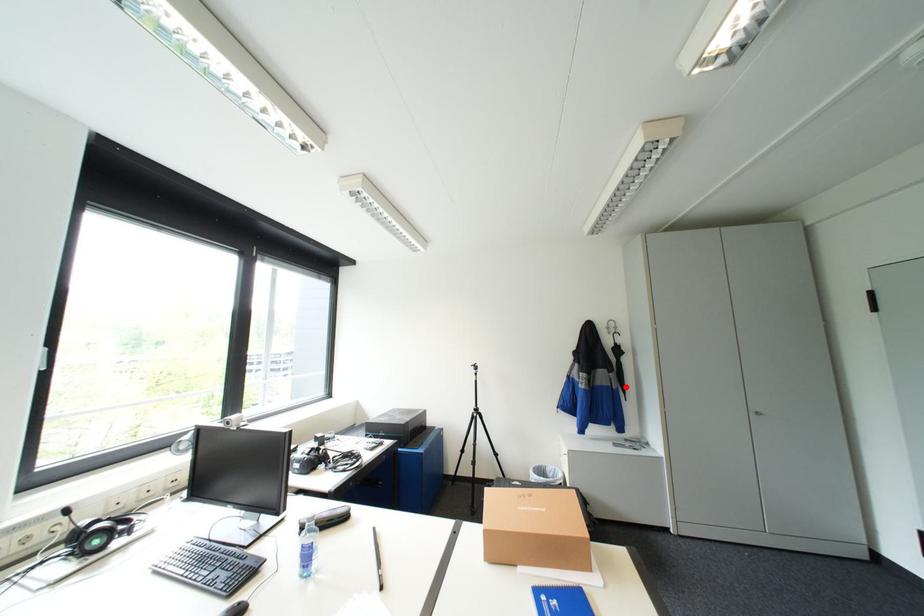
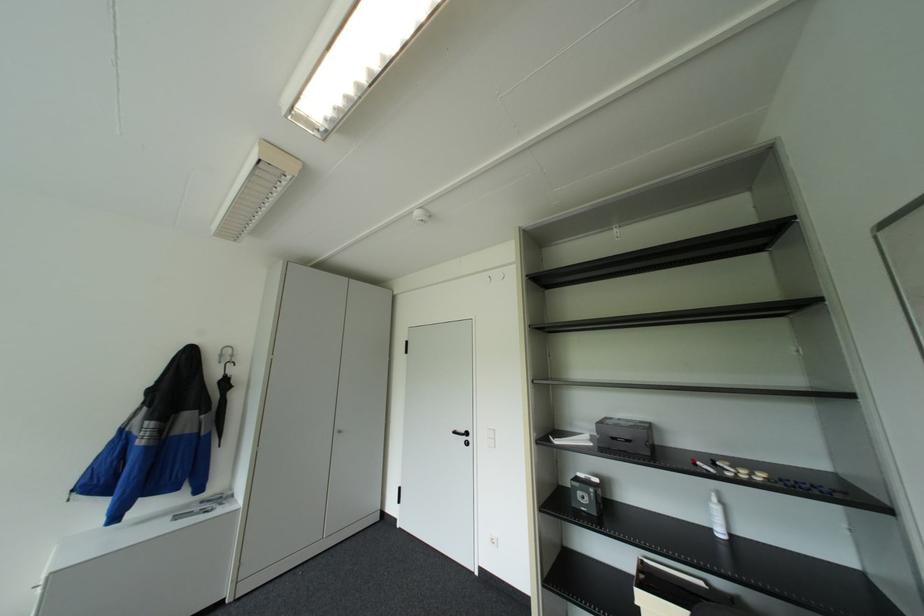
Question: I am providing you with two images of the same scene from different viewpoints. In image1, a red point is highlighted. Considering the same 3D point in image2, which of the following is correct?

Choices:
 (A) It is closer
 (B) It is farther

Answer: (A)